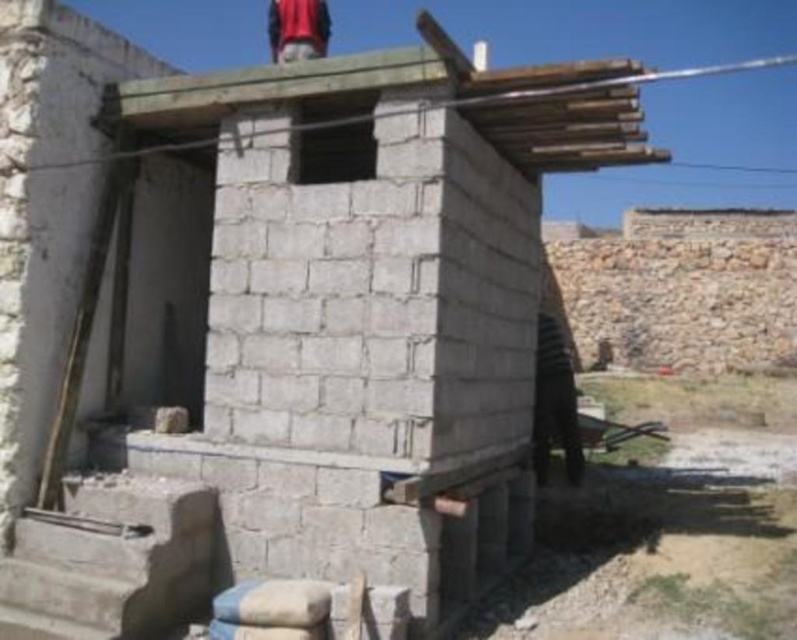
Consider the image. You are an architect examining the construction site. You notice the smooth wooden boards at upper center and the red fabric at upper center. Which object is narrower in width?

The smooth wooden boards at upper center has a lesser width compared to red fabric at upper center, so the smooth wooden boards at upper center is narrower in width.

Consider the image. You are a construction worker standing at the center of the construction site. You need to retrieve your dark brown leather jacket at lower right. According to the coordinates provided, in which direction should you move to reach it?

The dark brown leather jacket at lower right is located at coordinates point [554,403], which is to the lower right direction from your current position at the center. Move towards the lower right direction to reach it.

You are a construction worker who needs to place a 4.0 meter long metal beam between the smooth wooden boards at upper center and the red fabric at upper center. Can the metal beam fit between them without bending?

The distance between the smooth wooden boards at upper center and the red fabric at upper center is 3.91 meters. Since the metal beam is 4.0 meters long, it is slightly longer than the available space. Therefore, the metal beam cannot fit between them without bending.